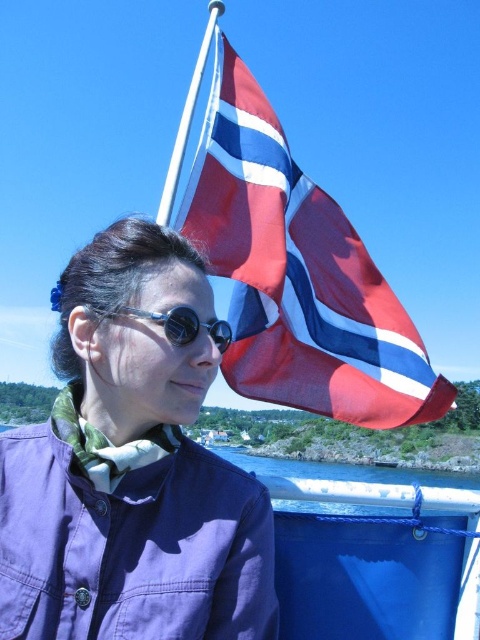
You are a fashion designer observing the scene. You need to determine which item is higher positioned between the purple fabric jacket at upper left and the black matte goggles at center. Which one is higher?

The purple fabric jacket at upper left is much taller than the black matte goggles at center, so the purple fabric jacket at upper left is positioned higher.

From the picture: You are a photographer trying to capture the Norwegian flag in the background. You notice the purple fabric jacket at upper left and the black matte goggles at center. Which object is closer to the camera? Explain your reasoning based on their positions.

The purple fabric jacket at upper left is closer to the camera because it is in front of the black matte goggles at center, meaning it blocks the view of the goggles partially.